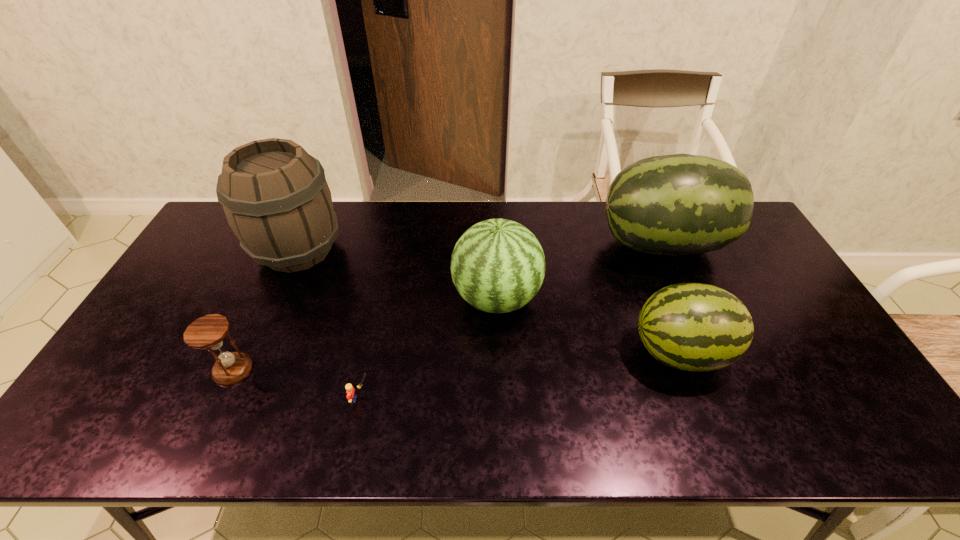
At what (x,y) coordinates should I click in order to perform the action: click on free space located 0.370m at the stem end of the shortest watermelon. Please return your answer as a coordinate pair (x, y). Image resolution: width=960 pixels, height=540 pixels. Looking at the image, I should click on (491, 352).

The height and width of the screenshot is (540, 960). What are the coordinates of `vacant region located 0.060m on the front of the hourglass` in the screenshot? It's located at (215, 408).

At what (x,y) coordinates should I click in order to perform the action: click on vacant space located on the front-facing side of the Lego. Please return your answer as a coordinate pair (x, y). Looking at the image, I should click on (458, 399).

This screenshot has height=540, width=960. What are the coordinates of `wine bucket positioned at the far edge` in the screenshot? It's located at (276, 199).

The width and height of the screenshot is (960, 540). Find the location of `watermelon that is at the far edge`. watermelon that is at the far edge is located at coordinates (680, 204).

What are the coordinates of `object that is at the right edge` in the screenshot? It's located at (680, 204).

Find the location of a particular element. Image resolution: width=960 pixels, height=540 pixels. object present at the far right corner is located at coordinates (680, 204).

This screenshot has height=540, width=960. I want to click on free space at the far edge of the desktop, so click(402, 205).

You are a GUI agent. You are given a task and a screenshot of the screen. Output one action in this format:
    pyautogui.click(x=<x>, y=<y>)
    Task: Click on the vacant space at the near edge of the desktop
    
    Given the screenshot: What is the action you would take?
    pyautogui.click(x=319, y=444)

The width and height of the screenshot is (960, 540). In the image, there is a desktop. Identify the location of vacant space at the left edge. (237, 253).